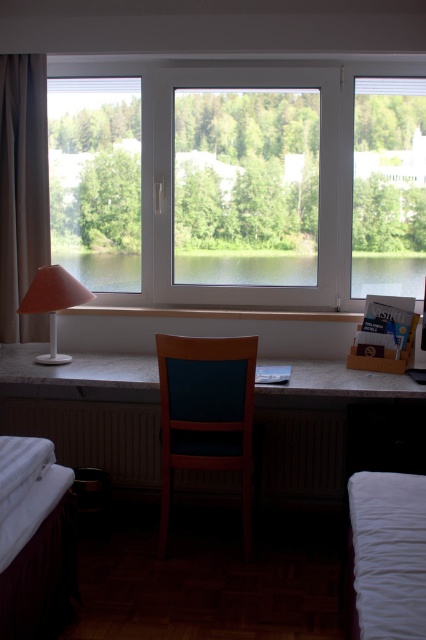
Does point (393, 544) come farther from viewer compared to point (187, 268)?

No, (393, 544) is closer to viewer.

What do you see at coordinates (388, 554) in the screenshot? I see `white soft bed at lower right` at bounding box center [388, 554].

Measure the distance between point (377, 604) and camera.

Point (377, 604) is 4.54 feet from camera.

This screenshot has height=640, width=426. I want to click on white soft bed at lower right, so click(x=388, y=554).

Is wooden chair at center thinner than transparent glass water at center?

Incorrect, wooden chair at center's width is not less than transparent glass water at center's.

Is wooden chair at center below transparent glass water at center?

Yes, wooden chair at center is below transparent glass water at center.

I want to click on wooden chair at center, so [206, 413].

Is wooden chair at center to the right of beige fabric curtain at left from the viewer's perspective?

Yes, wooden chair at center is to the right of beige fabric curtain at left.

Between wooden chair at center and beige fabric curtain at left, which one appears on the right side from the viewer's perspective?

Positioned to the right is wooden chair at center.

Does point (175, 387) come in front of point (26, 200)?

Yes.

Locate an element on the screen. wooden chair at center is located at coordinates (206, 413).